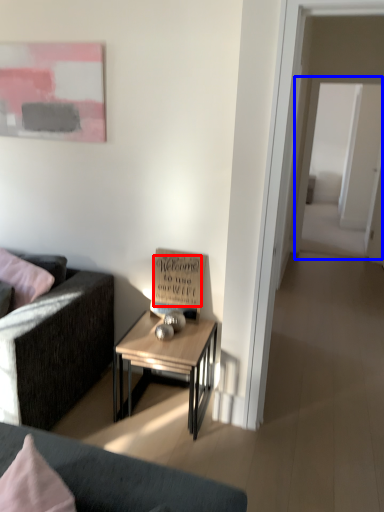
Question: Which object is further to the camera taking this photo, writing (highlighted by a red box) or glass door (highlighted by a blue box)?

Choices:
 (A) writing
 (B) glass door

Answer: (B)